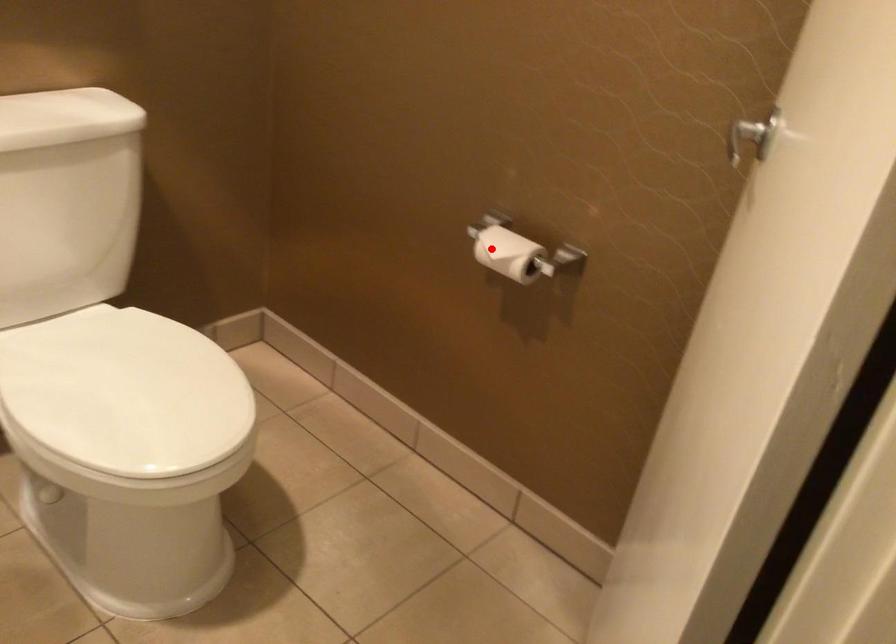
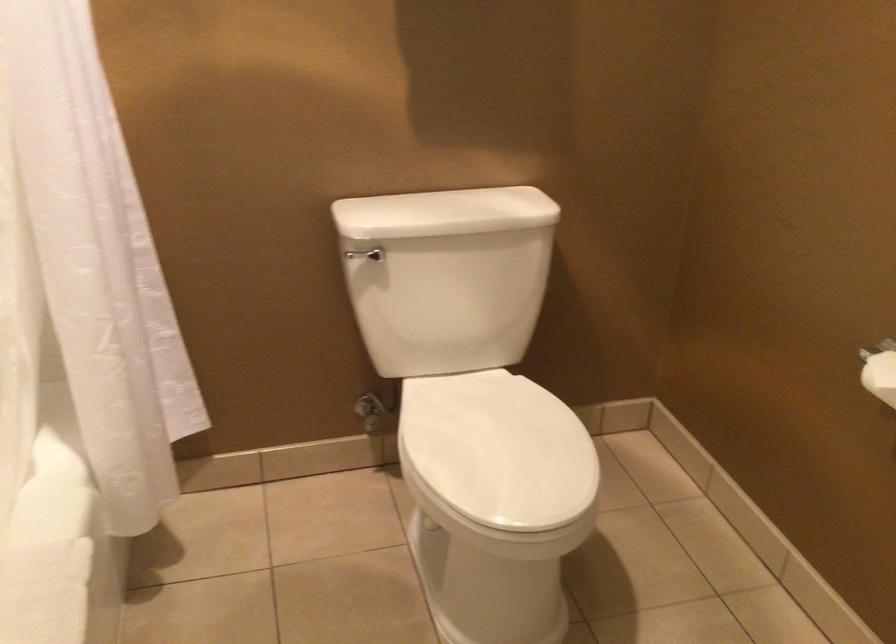
Locate, in the second image, the point that corresponds to the highlighted location in the first image.

(880, 375)